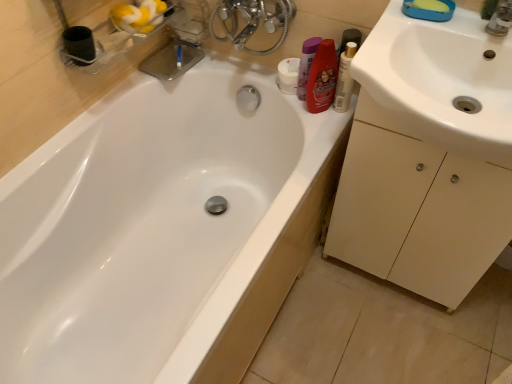
Describe the element at coordinates (172, 218) in the screenshot. The image size is (512, 384). I see `white glossy bathtub at upper left` at that location.

Identify the location of beige matte cabinet at right. The height and width of the screenshot is (384, 512). (417, 210).

Measure the distance between yellow sponge at upper right and camera.

yellow sponge at upper right and camera are 96.40 centimeters apart from each other.

What do you see at coordinates (438, 83) in the screenshot? I see `white glossy sink at right` at bounding box center [438, 83].

The height and width of the screenshot is (384, 512). In order to click on white glossy bathtub at upper left in this screenshot , I will do `click(172, 218)`.

Can you confirm if purple plastic bottle at upper right, positioned as the 2th toiletry in right-to-left order, is thinner than shiny plastic shampoo bottle at upper center, the first toiletry in the left-to-right sequence?

Correct, the width of purple plastic bottle at upper right, positioned as the 2th toiletry in right-to-left order, is less than that of shiny plastic shampoo bottle at upper center, the first toiletry in the left-to-right sequence.

In the scene shown: From the image's perspective, is purple plastic bottle at upper right, positioned as the 2th toiletry in right-to-left order, over shiny plastic shampoo bottle at upper center, the first toiletry in the left-to-right sequence?

No, from the image's perspective, purple plastic bottle at upper right, positioned as the 2th toiletry in right-to-left order, is not over shiny plastic shampoo bottle at upper center, the first toiletry in the left-to-right sequence.

This screenshot has height=384, width=512. In the image, there is a purple plastic bottle at upper right, marked as the second toiletry in a left-to-right arrangement. In order to click on toiletry below it (from a real-world perspective) in this screenshot , I will do `click(288, 75)`.

Would you say beige matte cabinet at right is part of white plastic mouthwash at upper right's contents?

No, beige matte cabinet at right is not inside white plastic mouthwash at upper right.

From a real-world perspective, is white plastic mouthwash at upper right physically located above or below beige matte cabinet at right?

In terms of real-world spatial position, white plastic mouthwash at upper right is above beige matte cabinet at right.

In terms of width, does white plastic mouthwash at upper right look wider or thinner when compared to beige matte cabinet at right?

In the image, white plastic mouthwash at upper right appears to be more narrow than beige matte cabinet at right.

Is white plastic mouthwash at upper right bigger or smaller than beige matte cabinet at right?

In the image, white plastic mouthwash at upper right appears to be smaller than beige matte cabinet at right.

Would you say white glossy bathtub at upper left is inside or outside beige matte cabinet at right?

white glossy bathtub at upper left is not inside beige matte cabinet at right, it's outside.

From a real-world perspective, is white glossy bathtub at upper left positioned over beige matte cabinet at right based on gravity?

No, from a real-world perspective, white glossy bathtub at upper left is not above beige matte cabinet at right.

Can you tell me how much white glossy bathtub at upper left and beige matte cabinet at right differ in facing direction?

They differ by 90 degrees in their facing directions.

Between white glossy bathtub at upper left and beige matte cabinet at right, which one appears on the left side from the viewer's perspective?

white glossy bathtub at upper left.

Which is in front, white plastic mouthwash at upper right or shiny red bottle at upper right, which is the third toiletry in left-to-right order?

shiny red bottle at upper right, which is the third toiletry in left-to-right order.

Is white plastic mouthwash at upper right completely or partially outside of shiny red bottle at upper right, the first toiletry viewed from the right?

Absolutely, white plastic mouthwash at upper right is external to shiny red bottle at upper right, the first toiletry viewed from the right.

Considering the relative sizes of white plastic mouthwash at upper right and shiny red bottle at upper right, which is the third toiletry in left-to-right order, in the image provided, is white plastic mouthwash at upper right shorter than shiny red bottle at upper right, which is the third toiletry in left-to-right order,?

In fact, white plastic mouthwash at upper right may be taller than shiny red bottle at upper right, which is the third toiletry in left-to-right order.

Considering the relative positions of beige matte cabinet at right and white glossy sink at right in the image provided, is beige matte cabinet at right to the right of white glossy sink at right from the viewer's perspective?

Yes, beige matte cabinet at right is to the right of white glossy sink at right.

In the scene shown: Considering the relative sizes of beige matte cabinet at right and white glossy sink at right in the image provided, is beige matte cabinet at right shorter than white glossy sink at right?

In fact, beige matte cabinet at right may be taller than white glossy sink at right.

You are a GUI agent. You are given a task and a screenshot of the screen. Output one action in this format:
    pyautogui.click(x=<x>, y=<y>)
    Task: Click on the cabinetry that appears behind the white glossy sink at right
    
    Given the screenshot: What is the action you would take?
    pyautogui.click(x=417, y=210)

From the image's perspective, is beige matte cabinet at right above white glossy sink at right?

No, from the image's perspective, beige matte cabinet at right is not above white glossy sink at right.

Considering the positions of objects shiny plastic shampoo bottle at upper center, the first toiletry in the left-to-right sequence, and yellow sponge at upper right in the image provided, who is more to the left, shiny plastic shampoo bottle at upper center, the first toiletry in the left-to-right sequence, or yellow sponge at upper right?

shiny plastic shampoo bottle at upper center, the first toiletry in the left-to-right sequence.

Is point (293, 83) positioned before point (426, 9)?

No, (293, 83) is behind (426, 9).

At what (x,y) coordinates should I click in order to perform the action: click on soap to the right of shiny plastic shampoo bottle at upper center, the first toiletry in the left-to-right sequence. Please return your answer as a coordinate pair (x, y). Looking at the image, I should click on tap(431, 5).

Could you tell me if white glossy sink at right is facing white glossy bathtub at upper left?

No.

The image size is (512, 384). I want to click on bathtub directly beneath the white glossy sink at right (from a real-world perspective), so click(x=172, y=218).

From the picture: Between white glossy sink at right and white glossy bathtub at upper left, which one has more height?

white glossy bathtub at upper left is taller.

The image size is (512, 384). I want to click on toiletry to the left of purple plastic bottle at upper right, positioned as the 2th toiletry in right-to-left order, so click(x=288, y=75).

Where is `cabinetry in front of the white plastic mouthwash at upper right`? cabinetry in front of the white plastic mouthwash at upper right is located at coordinates (417, 210).

From the image, which object appears to be farther from white glossy sink at right, beige matte cabinet at right or yellow sponge at upper right?

beige matte cabinet at right is further to white glossy sink at right.

Based on their spatial positions, is white glossy sink at right or yellow sponge at upper right further from white plastic mouthwash at upper right?

Among the two, white glossy sink at right is located further to white plastic mouthwash at upper right.

Considering their positions, is beige matte cabinet at right positioned closer to yellow sponge at upper right than white plastic mouthwash at upper right?

white plastic mouthwash at upper right lies closer to yellow sponge at upper right than the other object.

Estimate the real-world distances between objects in this image. Which object is further from yellow sponge at upper right, shiny plastic shampoo bottle at upper center, which is counted as the 3th toiletry, starting from the right, or beige matte cabinet at right?

beige matte cabinet at right is positioned further to the anchor yellow sponge at upper right.

Looking at the image, which one is located further to yellow sponge at upper right, purple plastic bottle at upper right, positioned as the 2th toiletry in right-to-left order, or white glossy sink at right?

purple plastic bottle at upper right, positioned as the 2th toiletry in right-to-left order, is further to yellow sponge at upper right.

Based on their spatial positions, is shiny red bottle at upper right, the first toiletry viewed from the right, or shiny plastic shampoo bottle at upper center, the first toiletry in the left-to-right sequence, further from beige matte cabinet at right?

Among the two, shiny plastic shampoo bottle at upper center, the first toiletry in the left-to-right sequence, is located further to beige matte cabinet at right.

When comparing their distances from yellow sponge at upper right, does white plastic mouthwash at upper right or purple plastic bottle at upper right, positioned as the 2th toiletry in right-to-left order, seem further?

purple plastic bottle at upper right, positioned as the 2th toiletry in right-to-left order.

Which object lies nearer to the anchor point yellow sponge at upper right, shiny plastic shampoo bottle at upper center, the first toiletry in the left-to-right sequence, or white plastic mouthwash at upper right?

Based on the image, white plastic mouthwash at upper right appears to be nearer to yellow sponge at upper right.

This screenshot has width=512, height=384. Identify the location of mouthwash between yellow sponge at upper right and shiny plastic shampoo bottle at upper center, the first toiletry in the left-to-right sequence, from front to back. (344, 79).

Find the location of a particular element. This screenshot has width=512, height=384. cabinetry between white glossy sink at right and shiny red bottle at upper right, which is the third toiletry in left-to-right order, from front to back is located at coordinates (417, 210).

Where is `mouthwash positioned between white glossy bathtub at upper left and shiny plastic shampoo bottle at upper center, which is counted as the 3th toiletry, starting from the right, from near to far`? Image resolution: width=512 pixels, height=384 pixels. mouthwash positioned between white glossy bathtub at upper left and shiny plastic shampoo bottle at upper center, which is counted as the 3th toiletry, starting from the right, from near to far is located at coordinates (344, 79).

Image resolution: width=512 pixels, height=384 pixels. What are the coordinates of `sink between yellow sponge at upper right and beige matte cabinet at right in the vertical direction` in the screenshot? It's located at (438, 83).